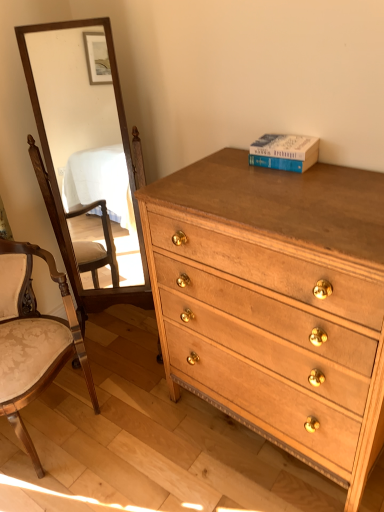
Image resolution: width=384 pixels, height=512 pixels. Identify the location of free area in between light brown wood chest of drawers at center and wooden upholstered chair at left. (158, 449).